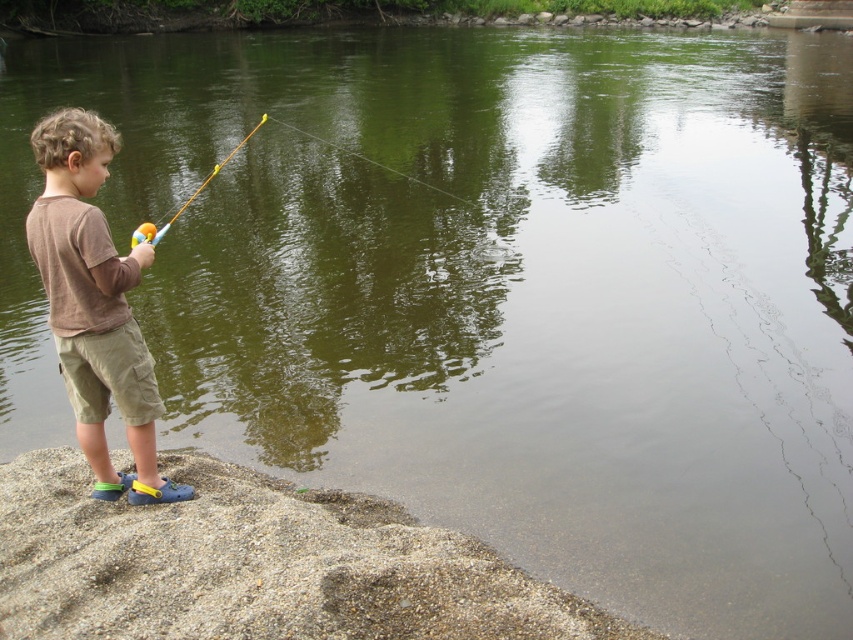
Consider the image. The child is holding the blue plastic fishing pole at left. Where is the brown cotton shirt at left in relation to the fishing pole?

The brown cotton shirt at left is located below the blue plastic fishing pole at left.

You are a child trying to cast your fishing line further into the water. The blue plastic fishing pole at left and the transparent plastic fishing line at center are part of your setup. Which object should you move to achieve this goal?

To cast the fishing line further, you should move the blue plastic fishing pole at left to the right side of the transparent plastic fishing line at center, as it is currently positioned on the left side of it.